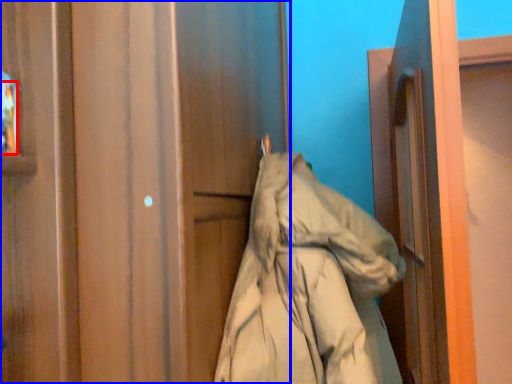
Question: Among these objects, which one is farthest to the camera, person (highlighted by a red box) or door (highlighted by a blue box)?

Choices:
 (A) person
 (B) door

Answer: (A)